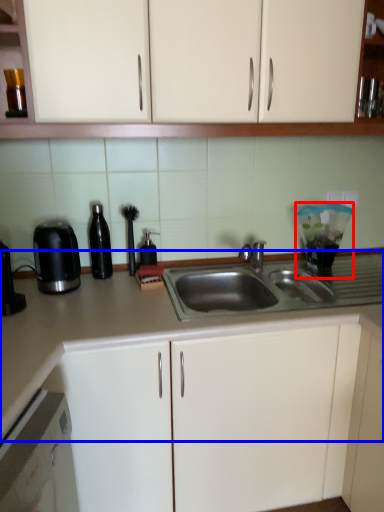
Question: Which object is further to the camera taking this photo, appliance (highlighted by a red box) or countertop (highlighted by a blue box)?

Choices:
 (A) appliance
 (B) countertop

Answer: (A)